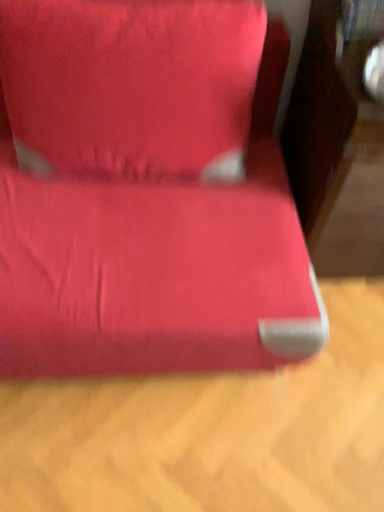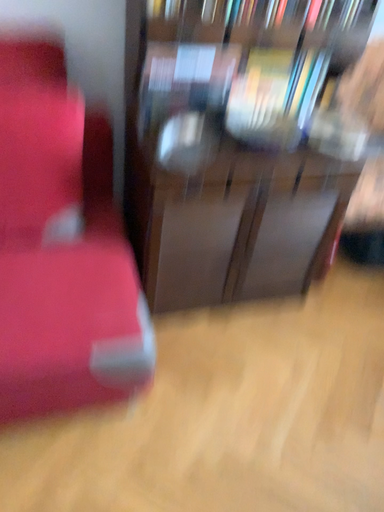
Question: Which way did the camera rotate in the video?

Choices:
 (A) rotated left
 (B) rotated right

Answer: (B)